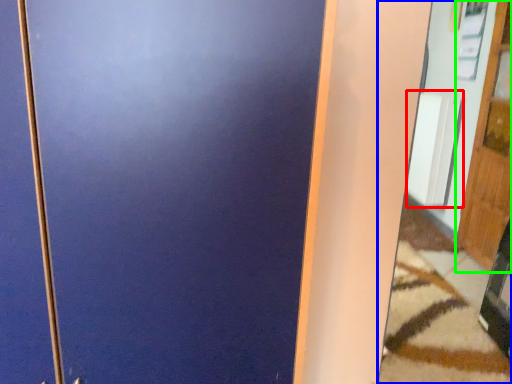
Question: Which object is positioned farthest from radiator (highlighted by a red box)? Select from mirror (highlighted by a blue box) and door (highlighted by a green box).

Choices:
 (A) mirror
 (B) door

Answer: (B)